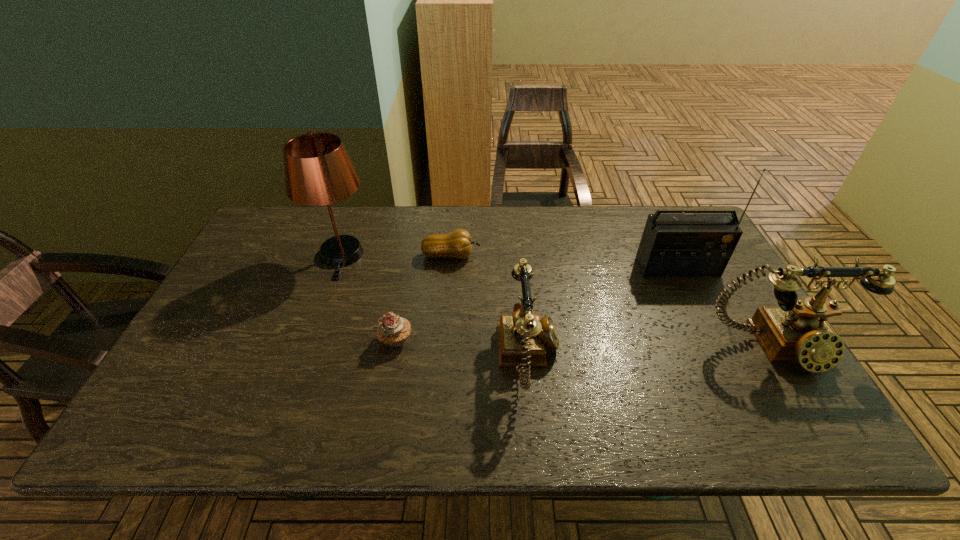
The height and width of the screenshot is (540, 960). What are the coordinates of `free space between the left telephone and the right telephone` in the screenshot? It's located at (653, 352).

Locate an element on the screen. Image resolution: width=960 pixels, height=540 pixels. unoccupied position between the shorter telephone and the radio receiver is located at coordinates (604, 313).

Find the location of `vacant space that's between the lampshade and the cupcake`. vacant space that's between the lampshade and the cupcake is located at coordinates (369, 298).

In order to click on unoccupied area between the cupcake and the right telephone in this screenshot , I will do `click(586, 343)`.

Choose which object is the third nearest neighbor to the shorter telephone. Please provide its 2D coordinates. Your answer should be formatted as a tuple, i.e. [(x, y)], where the tuple contains the x and y coordinates of a point satisfying the conditions above.

[(673, 245)]

You are a GUI agent. You are given a task and a screenshot of the screen. Output one action in this format:
    pyautogui.click(x=<x>, y=<y>)
    Task: Click on the object that can be found as the fourth closest to the gourd
    This screenshot has width=960, height=540.
    Given the screenshot: What is the action you would take?
    pyautogui.click(x=673, y=245)

Where is `vacant area that satisfies the following two spatial constraints: 1. on the front panel of the radio receiver; 2. on the dial number of the left telephone`? This screenshot has height=540, width=960. vacant area that satisfies the following two spatial constraints: 1. on the front panel of the radio receiver; 2. on the dial number of the left telephone is located at coordinates (722, 357).